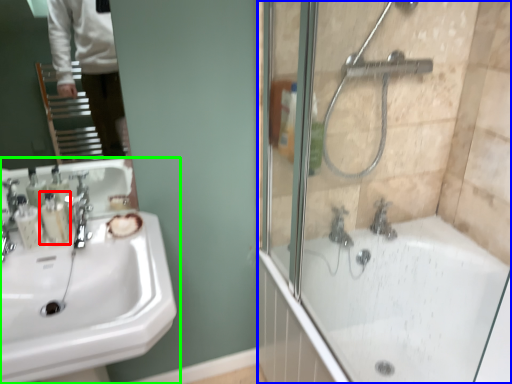
Question: Which object is positioned closest to toiletry (highlighted by a red box)? Select from screen door (highlighted by a blue box) and sink (highlighted by a green box).

Choices:
 (A) screen door
 (B) sink

Answer: (B)